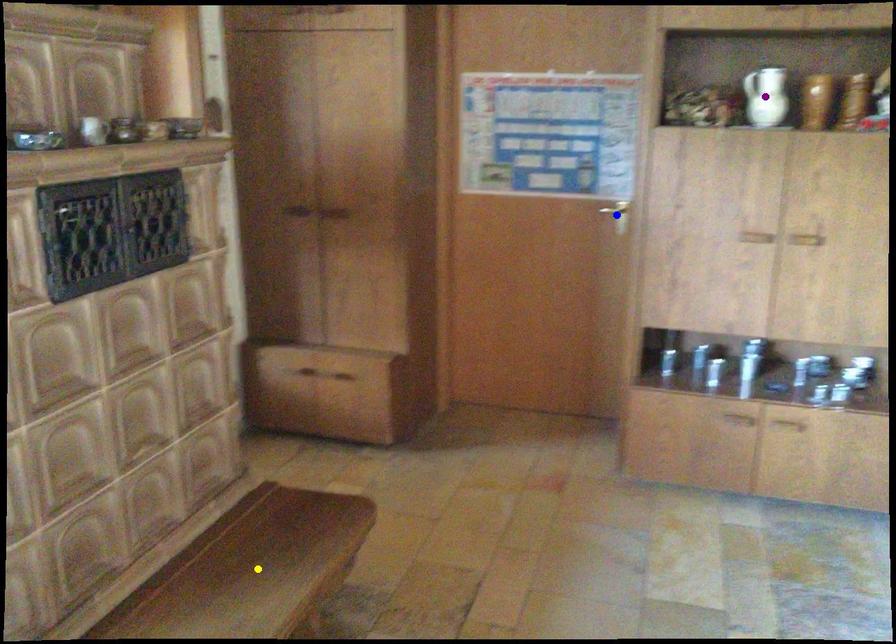
Order these from nearest to farthest:
A) blue point
B) yellow point
C) purple point

1. blue point
2. purple point
3. yellow point